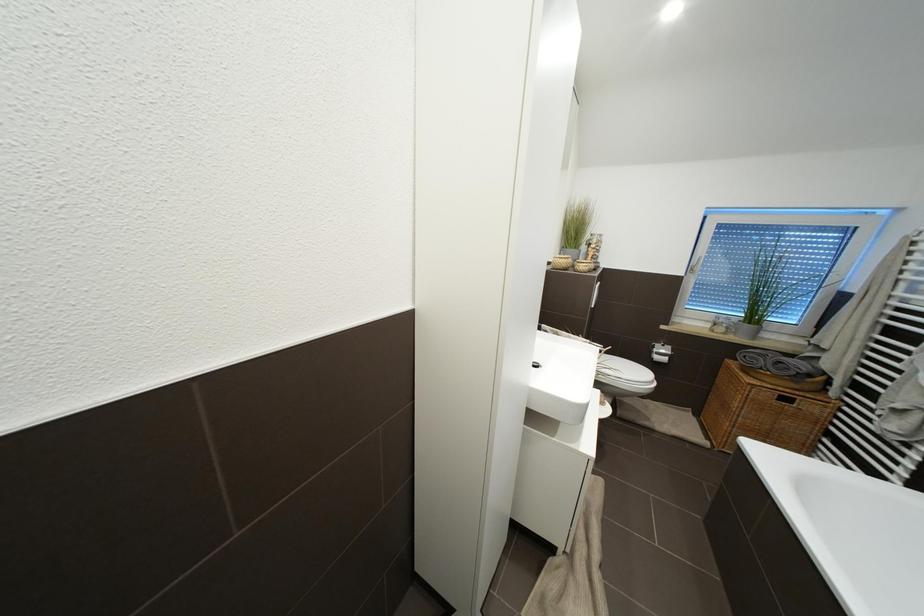
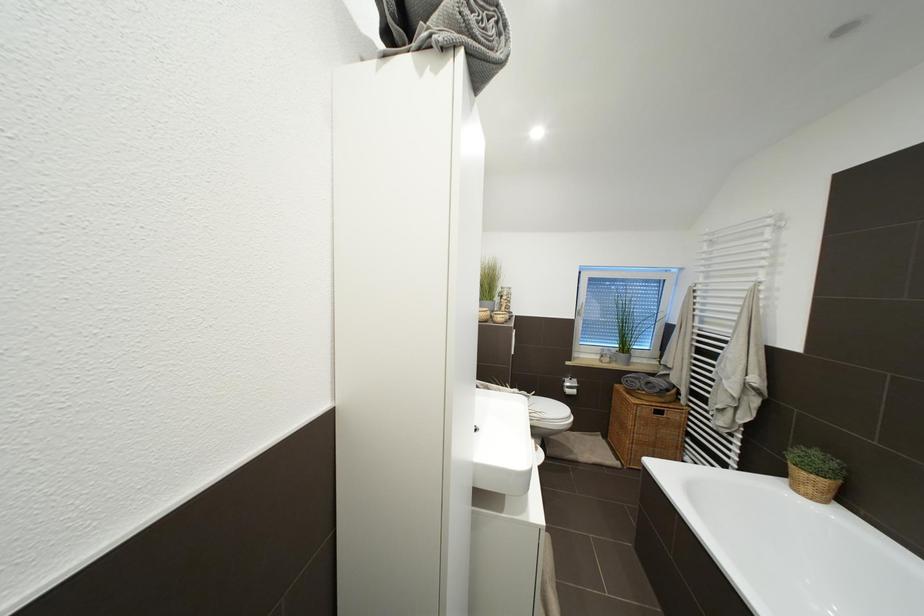
Which direction would the cameraman need to move to produce the second image?

The cameraman moved toward left, forward.